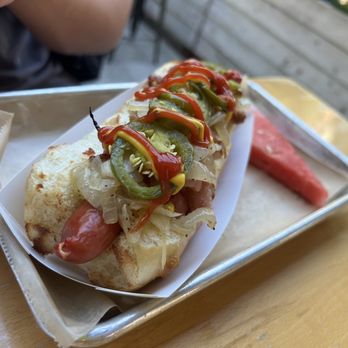
Locate an element on the screen. This screenshot has height=348, width=348. table is located at coordinates (307, 106).